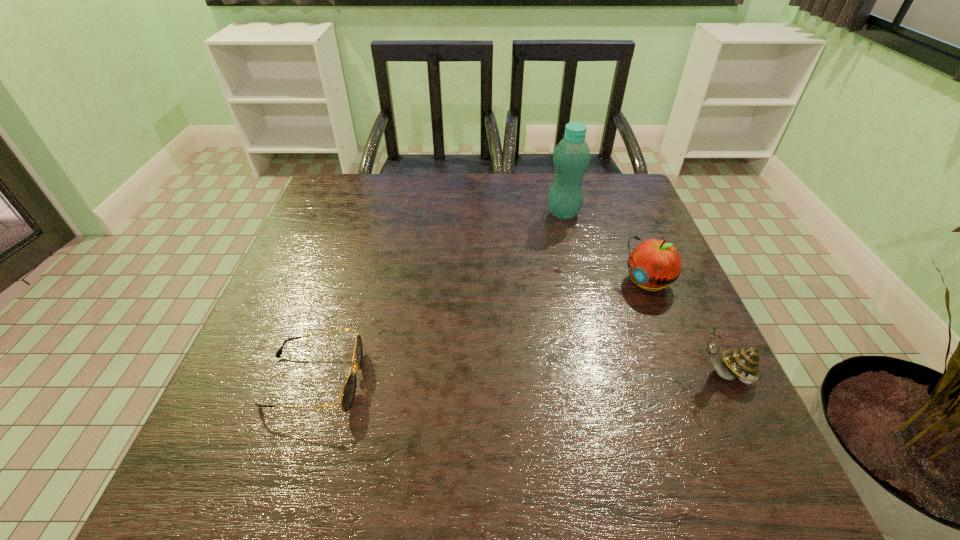
Where is `the shortest object`? The height and width of the screenshot is (540, 960). the shortest object is located at coordinates (348, 393).

This screenshot has height=540, width=960. I want to click on the leftmost object, so click(348, 393).

Find the location of a particular element. This screenshot has height=540, width=960. snail is located at coordinates (743, 364).

The image size is (960, 540). Identify the location of water bottle. (571, 157).

This screenshot has width=960, height=540. What are the coordinates of `the second object from left to right` in the screenshot? It's located at (571, 157).

Identify the location of apple. This screenshot has height=540, width=960. (653, 264).

At what (x,y) coordinates should I click in order to perform the action: click on vacant space located on the front-facing side of the sunglasses. Please return your answer as a coordinate pair (x, y). Looking at the image, I should click on (510, 381).

Identify the location of vacant space located 0.290m on the face of the snail. This screenshot has height=540, width=960. (538, 375).

Find the location of a particular element. Image resolution: width=960 pixels, height=540 pixels. vacant space located 0.380m on the face of the snail is located at coordinates (491, 375).

The image size is (960, 540). I want to click on blank area located 0.380m on the face of the snail, so click(491, 375).